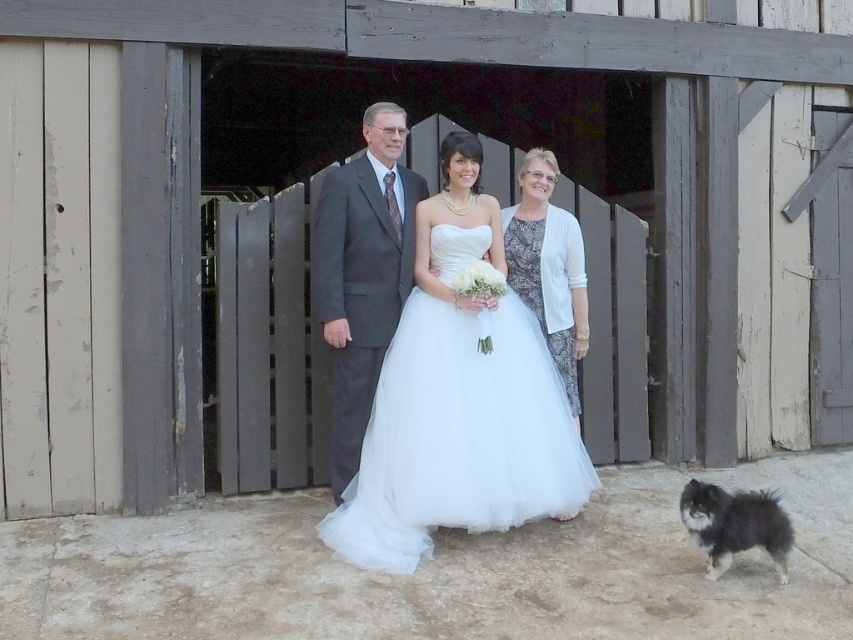
Is dark gray suit at center shorter than fluffy black fur dog at lower right?

In fact, dark gray suit at center may be taller than fluffy black fur dog at lower right.

In the scene shown: Is dark gray suit at center above fluffy black fur dog at lower right?

Yes.

Does point (331, 209) come behind point (701, 504)?

Yes.

Where is `dark gray suit at center`? Image resolution: width=853 pixels, height=640 pixels. dark gray suit at center is located at coordinates (363, 273).

Who is more distant from viewer, [474,342] or [715,560]?

Point [474,342]

I want to click on white tulle wedding dress at center, so click(459, 435).

Is dark gray suit at center positioned behind white textured dress at center?

No, dark gray suit at center is closer to the viewer.

In the scene shown: Between dark gray suit at center and white textured dress at center, which one is positioned lower?

dark gray suit at center is below.

Identify the location of dark gray suit at center. (363, 273).

This screenshot has height=640, width=853. I want to click on dark gray suit at center, so click(363, 273).